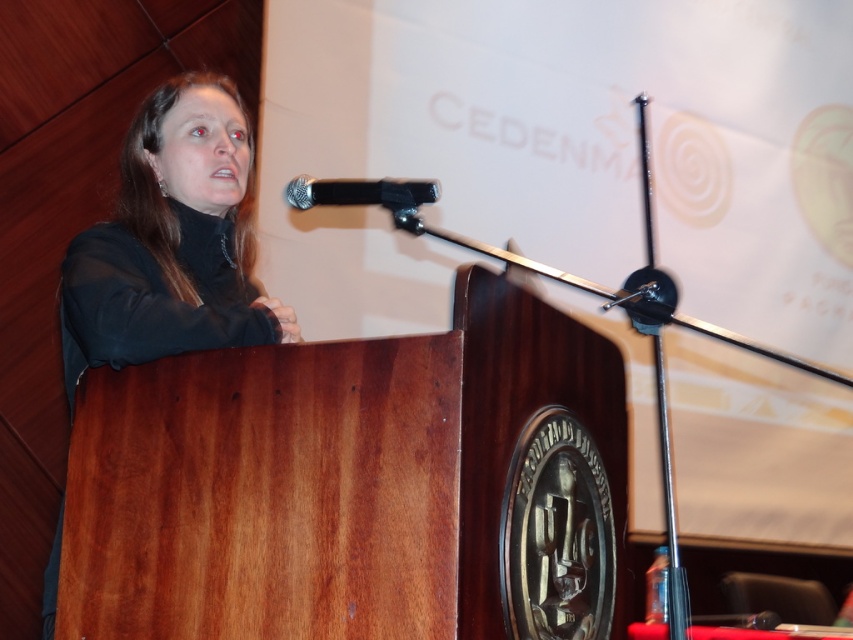
Is black matte/tacky sweater at upper left to the left of black matte microphone at upper center from the viewer's perspective?

Yes, black matte/tacky sweater at upper left is to the left of black matte microphone at upper center.

Is black matte/tacky sweater at upper left positioned before black matte microphone at upper center?

No, black matte/tacky sweater at upper left is further to the viewer.

Describe the element at coordinates (172, 241) in the screenshot. I see `black matte/tacky sweater at upper left` at that location.

This screenshot has height=640, width=853. I want to click on black matte/tacky sweater at upper left, so click(x=172, y=241).